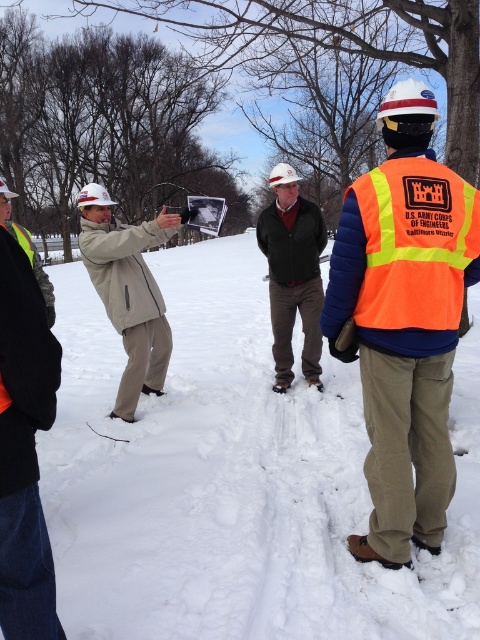
You are an observer standing in front of the snowy scene. You see the white powdery snow at center and the beige fabric jacket at center. Which object takes up more space in the image?

The white powdery snow at center takes up more space in the image because it has a larger size compared to the beige fabric jacket at center.

You are a safety inspector assessing the visibility of workers in the snowy environment. You notice the orange reflective vest at center and the green matte jacket at center. Which clothing item takes up more space in the scene?

The green matte jacket at center occupies more space than the orange reflective vest at center, so the green matte jacket at center takes up more space in the scene.